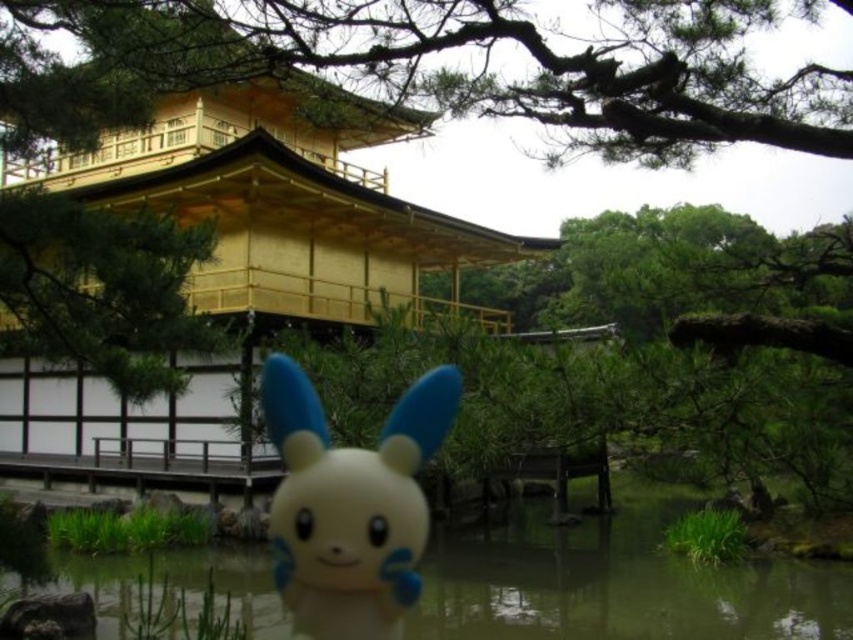
You are a photographer standing in front of the Kinkakuji Golden Pavilion. You notice the transparent plastic water at lower center and the white matte plush at center. Which object is closer to the camera?

The white matte plush at center is closer to the camera because the transparent plastic water at lower center is below it, indicating it is positioned further back.

You are standing in front of the Kinkakuji Golden Pavilion and want to take a photo that includes both the golden pavilion and the small plush toy. The camera can only focus on objects at a specific distance. Which point, point (775, 620) or point (335, 461), is closer to you and should be focused on to ensure both are in focus?

Point (775, 620) is closer to you than point (335, 461). To ensure both are in focus, focus on the closer point, which is point (775, 620).

You are standing in front of the Kinkakuji Golden Pavilion and see the transparent plastic water at lower center and the white matte plush at center. Which object is closer to you?

The transparent plastic water at lower center is closer to you because the white matte plush at center is behind it.